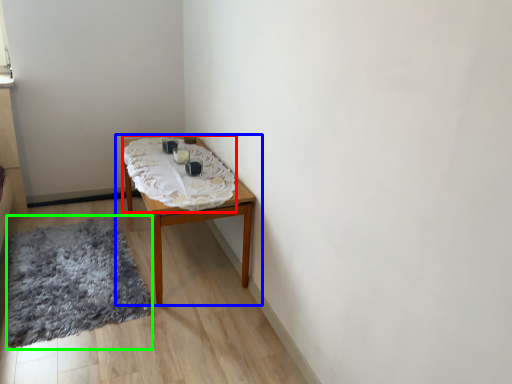
Question: Which object is the farthest from blanket (highlighted by a red box)? Choose among these: table (highlighted by a blue box) or mat (highlighted by a green box).

Choices:
 (A) table
 (B) mat

Answer: (B)